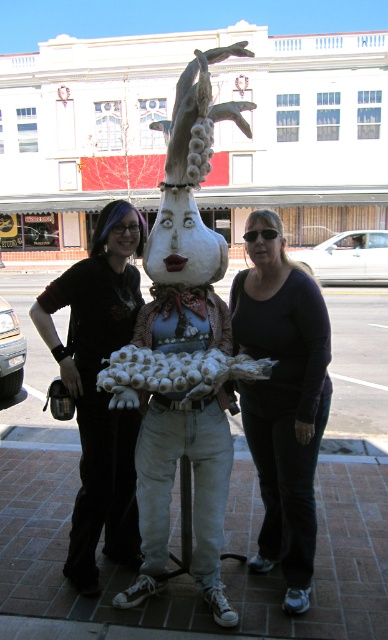
Question: Can you confirm if white matte sculpture at center is positioned below black matte pants at lower center?

Choices:
 (A) no
 (B) yes

Answer: (A)

Question: Can you confirm if brick pavement at center is bigger than black matte pants at lower center?

Choices:
 (A) no
 (B) yes

Answer: (B)

Question: Which point is closer to the camera?

Choices:
 (A) (344, 620)
 (B) (202, 102)
 (C) (315, 419)

Answer: (B)

Question: Among these objects, which one is farthest from the camera?

Choices:
 (A) matte black shirt at center
 (B) white matte sculpture at center

Answer: (A)

Question: Estimate the real-world distances between objects in this image. Which object is farther from the black matte pants at lower center?

Choices:
 (A) brick pavement at center
 (B) matte black shirt at center
 (C) white matte sculpture at center

Answer: (A)

Question: Is brick pavement at center positioned in front of matte black shirt at center?

Choices:
 (A) yes
 (B) no

Answer: (A)